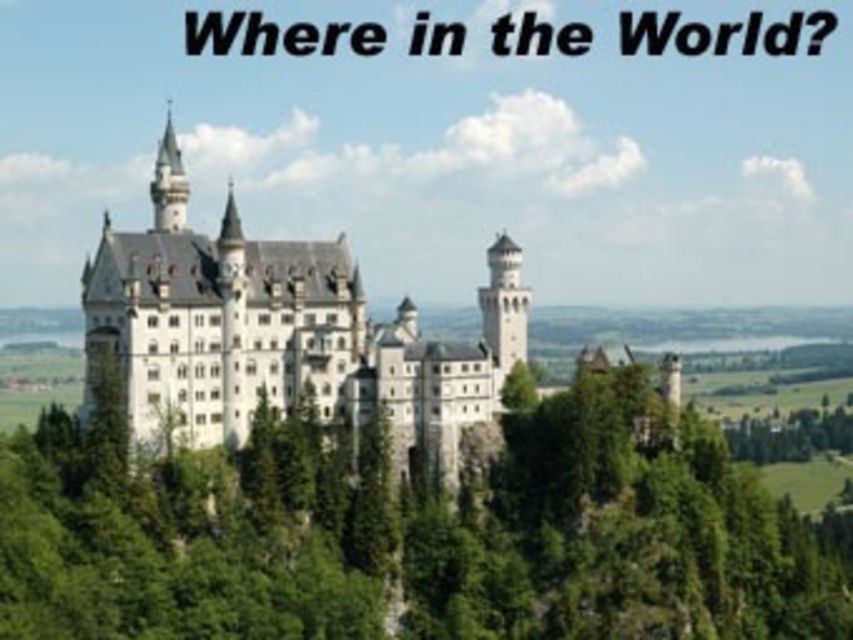
Question: Is green leafy tree at center thinner than white stone castle at center?

Choices:
 (A) no
 (B) yes

Answer: (A)

Question: Among these objects, which one is farthest from the camera?

Choices:
 (A) green leafy tree at center
 (B) white stone castle at center

Answer: (B)

Question: Can you confirm if green leafy tree at center is positioned to the left of white stone castle at center?

Choices:
 (A) yes
 (B) no

Answer: (B)

Question: Is green leafy tree at center behind white stone castle at center?

Choices:
 (A) yes
 (B) no

Answer: (B)

Question: Which point is closer to the camera?

Choices:
 (A) white stone castle at center
 (B) green leafy tree at center

Answer: (B)